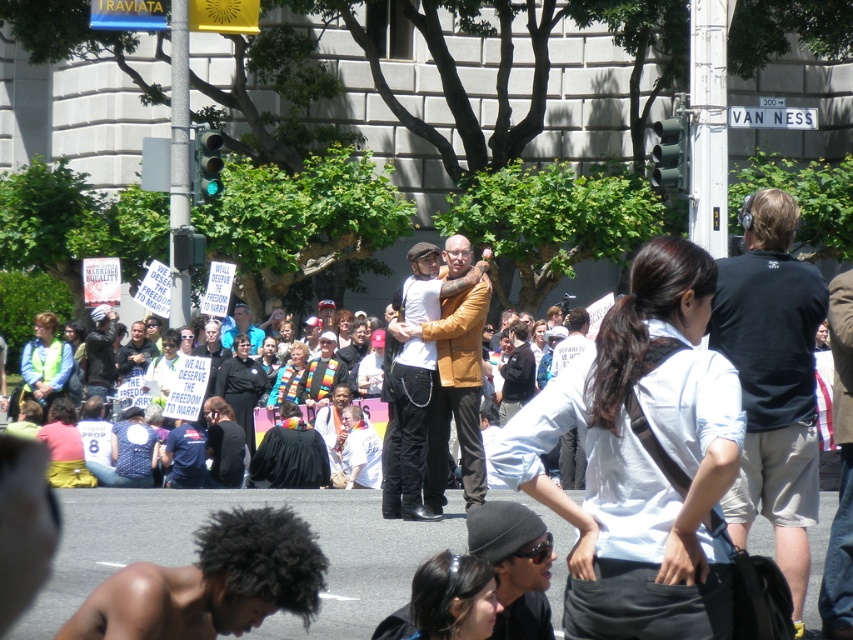
Question: Is black cotton t-shirt at right wider than brown leather jacket at center?

Choices:
 (A) yes
 (B) no

Answer: (B)

Question: Which is nearer to the matte black jacket at center?

Choices:
 (A) black cotton t-shirt at right
 (B) brown leather jacket at center

Answer: (B)

Question: Does brown leather jacket at center appear under matte black jacket at center?

Choices:
 (A) yes
 (B) no

Answer: (B)

Question: Which of the following is the farthest from the observer?

Choices:
 (A) matte black jacket at center
 (B) brown leather jacket at center
 (C) black cotton t-shirt at right

Answer: (A)

Question: Is black cotton t-shirt at right to the right of brown leather jacket at center from the viewer's perspective?

Choices:
 (A) no
 (B) yes

Answer: (B)

Question: Which of the following is the closest to the observer?

Choices:
 (A) (769, 396)
 (B) (408, 433)

Answer: (A)